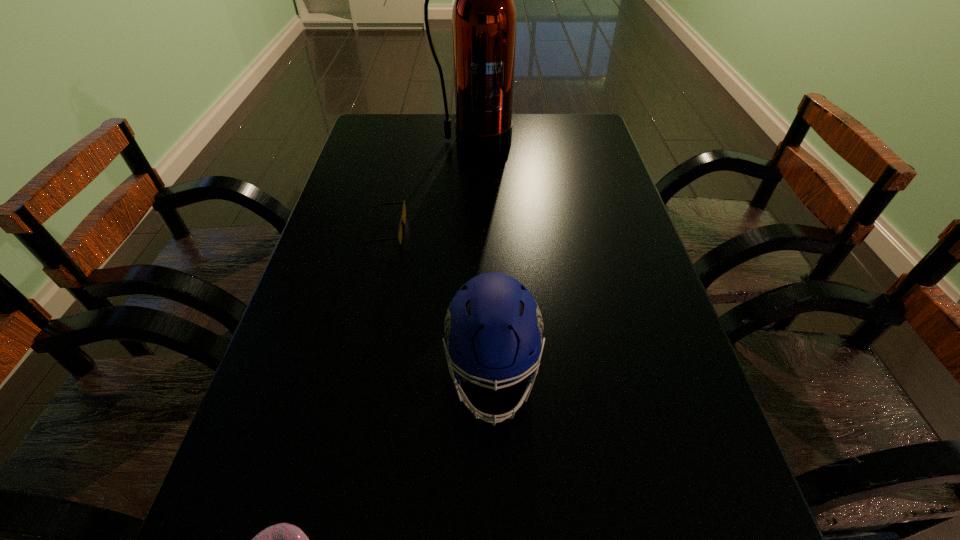
I want to click on the tallest object, so click(x=484, y=19).

Where is `the farthest object`? This screenshot has height=540, width=960. the farthest object is located at coordinates click(x=484, y=19).

Locate an element on the screen. This screenshot has height=540, width=960. the second tallest object is located at coordinates (493, 329).

In order to click on the second nearest object in this screenshot , I will do `click(493, 329)`.

This screenshot has width=960, height=540. What are the coordinates of `the second shortest object` in the screenshot? It's located at (399, 237).

Where is `the second farthest object`? This screenshot has height=540, width=960. the second farthest object is located at coordinates tap(399, 237).

Identify the location of vacant space located 0.360m on the front-facing side of the fire extinguisher. This screenshot has width=960, height=540. (470, 234).

Identify the location of vacant point located on the front-facing side of the second nearest object. This screenshot has height=540, width=960. (495, 481).

You are a GUI agent. You are given a task and a screenshot of the screen. Output one action in this format:
    pyautogui.click(x=<x>, y=<y>)
    Task: Click on the vacant space located on the front-facing side of the sunglasses
    
    Given the screenshot: What is the action you would take?
    pyautogui.click(x=560, y=232)

Locate an element on the screen. object located at the far edge is located at coordinates (484, 19).